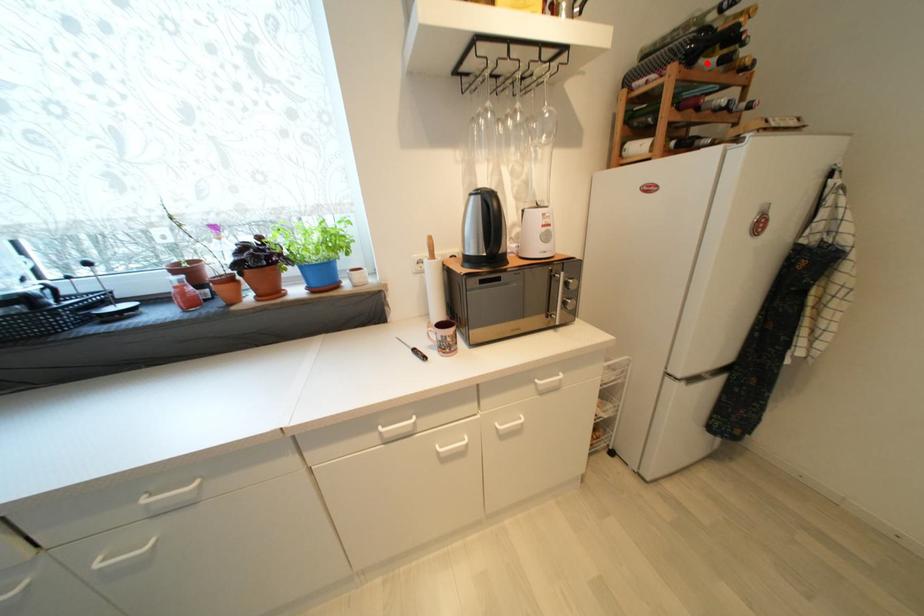
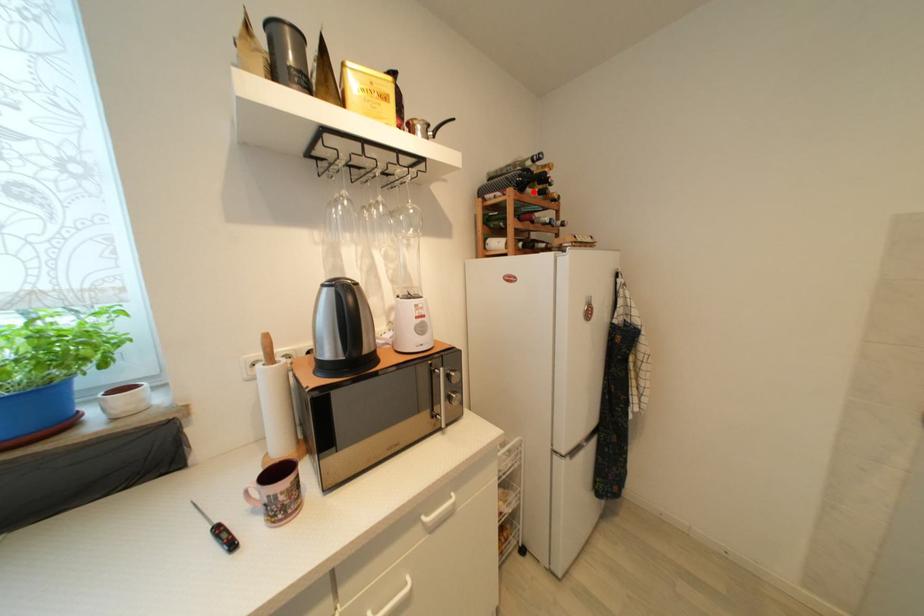
I am providing you with two images of the same scene from different viewpoints. A red point is marked on the first image and another point is marked on the second image. Does the point marked in image1 correspond to the same location as the one in image2?

Yes